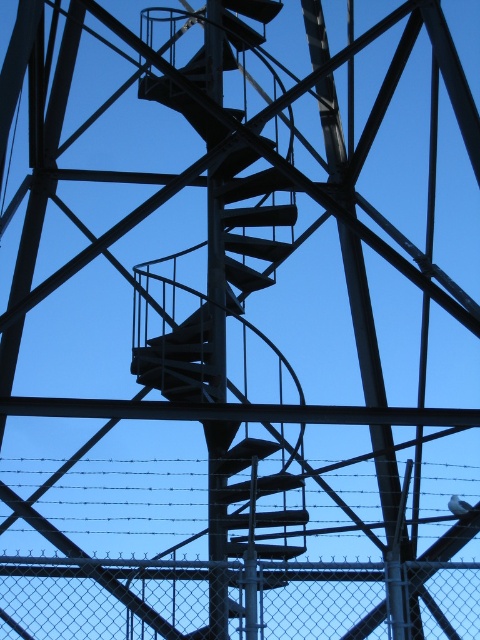
You are a drone operator tasked with inspecting the spiral staircase. Your drone has a maximum flight range of 25 meters. If you are currently at the camera position, can your drone safely reach the chain link fence at center without exceeding its range?

The chain link fence at center is 25.97 meters away from camera. Since the drone has a maximum flight range of 25 meters, it cannot safely reach the chain link fence at center as it exceeds the drone range limit.

You are standing at the base of the structure and want to walk up the metallic spiral staircase at center. Given that the staircase is 87.41 feet away from you, can you estimate how many steps you would need to climb to reach the top?

The metallic spiral staircase at center is 87.41 feet away from the viewer. However, the number of steps required to reach the top cannot be determined solely from the distance provided.